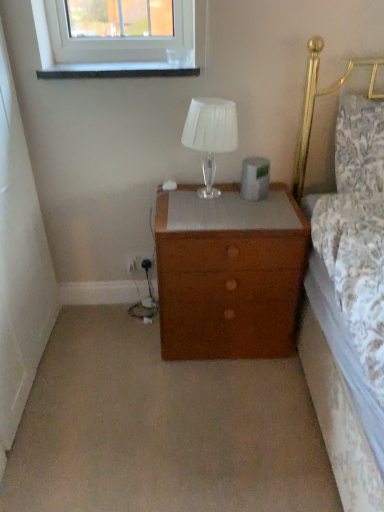
Question: Looking at the image, does floral fabric pillow at right seem bigger or smaller compared to wooden nightstand at center?

Choices:
 (A) small
 (B) big

Answer: (A)

Question: In the image, is floral fabric pillow at right positioned in front of or behind wooden nightstand at center?

Choices:
 (A) front
 (B) behind

Answer: (A)

Question: Which object is positioned closest to the wooden nightstand at center?

Choices:
 (A) translucent glass table lamp at upper center
 (B) floral fabric pillow at right
 (C) granite-like stone window sill at upper left

Answer: (A)

Question: Estimate the real-world distances between objects in this image. Which object is farther from the granite-like stone window sill at upper left?

Choices:
 (A) translucent glass table lamp at upper center
 (B) wooden nightstand at center
 (C) floral fabric pillow at right

Answer: (B)